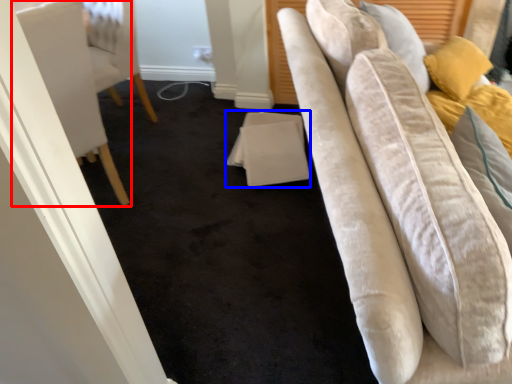
Question: Among these objects, which one is farthest to the camera, furniture (highlighted by a red box) or table (highlighted by a blue box)?

Choices:
 (A) furniture
 (B) table

Answer: (B)